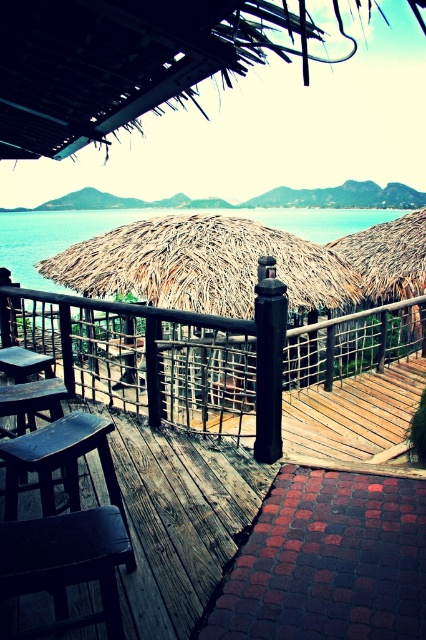
In the scene shown: You are a guest staying at the resort and want to place your beach bag on the dark wood stool at lower left. However, you are currently standing on the wooden deck at center. Can you easily reach the stool without stepping off the deck?

The dark wood stool at lower left is behind the wooden deck at center, so you cannot easily reach it while standing on the wooden deck at center without stepping off.

You are a guest staying at the resort and want to move from the wooden deck at center to the dark wood stool at lower left. The path between them is clear. If your wheelchair has a turning radius of 1.2 meters, can you navigate the space comfortably?

The distance between the wooden deck at center and the dark wood stool at lower left is 4.37 meters. Since the wheelchair requires a turning radius of 1.2 meters, and the path is clear, the guest can navigate the space comfortably as the distance allows sufficient room for maneuvering.

You are standing on the wooden deck and want to take a photo of both the point at coordinates (187, 349) and the point at coordinates (89, 545). Which point should you focus on first to ensure both are in focus?

You should focus on the point at coordinates (187, 349) first because it is closer to the camera than the point at coordinates (89, 545). This ensures the foreground point is in focus while the background point remains sharp due to the depth of field.